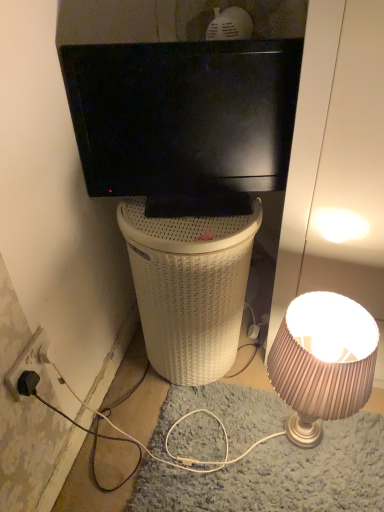
Question: From the image's perspective, is shiny beige lampshade at right above or below white wicker trash bin/can at center?

Choices:
 (A) above
 (B) below

Answer: (B)

Question: In terms of width, does shiny beige lampshade at right look wider or thinner when compared to white wicker trash bin/can at center?

Choices:
 (A) wide
 (B) thin

Answer: (B)

Question: Considering the real-world distances, which object is farthest from the black plastic power outlet at lower left?

Choices:
 (A) white wicker trash bin/can at center
 (B) black glossy television at upper center
 (C) shiny beige lampshade at right

Answer: (C)

Question: Based on their relative distances, which object is farther from the shiny beige lampshade at right?

Choices:
 (A) white wicker trash bin/can at center
 (B) black plastic power outlet at lower left
 (C) black glossy television at upper center

Answer: (B)